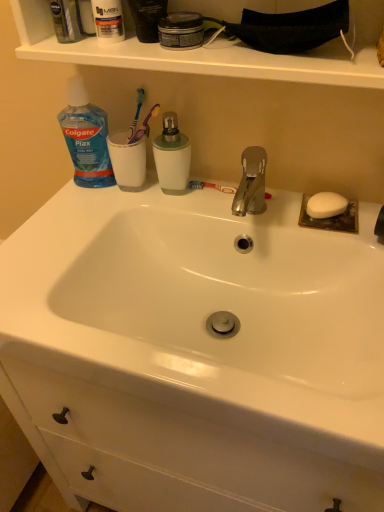
Question: From the image's perspective, is blue plastic toothbrush at upper center on green matte mouthwash at center, marked as the 1th mouthwash in a right-to-left arrangement?

Choices:
 (A) no
 (B) yes

Answer: (B)

Question: Does blue plastic toothbrush at upper center have a lesser width compared to green matte mouthwash at center, the first mouthwash in the bottom-to-top sequence?

Choices:
 (A) yes
 (B) no

Answer: (A)

Question: Is blue plastic toothbrush at upper center looking in the opposite direction of green matte mouthwash at center, positioned as the 2th mouthwash in top-to-bottom order?

Choices:
 (A) yes
 (B) no

Answer: (B)

Question: Does blue plastic toothbrush at upper center have a greater width compared to green matte mouthwash at center, marked as the 1th mouthwash in a right-to-left arrangement?

Choices:
 (A) yes
 (B) no

Answer: (B)

Question: Would you say blue plastic toothbrush at upper center contains green matte mouthwash at center, marked as the 1th mouthwash in a right-to-left arrangement?

Choices:
 (A) yes
 (B) no

Answer: (B)

Question: Does blue plastic toothbrush at upper center come behind green matte mouthwash at center, the first mouthwash in the bottom-to-top sequence?

Choices:
 (A) no
 (B) yes

Answer: (B)

Question: Can you confirm if white matte soap at right is taller than white glossy sink at center?

Choices:
 (A) yes
 (B) no

Answer: (B)

Question: Can you confirm if white matte soap at right is thinner than white glossy sink at center?

Choices:
 (A) no
 (B) yes

Answer: (B)

Question: Can you confirm if white matte soap at right is wider than white glossy sink at center?

Choices:
 (A) no
 (B) yes

Answer: (A)

Question: Considering the relative sizes of white matte soap at right and white glossy sink at center in the image provided, is white matte soap at right bigger than white glossy sink at center?

Choices:
 (A) no
 (B) yes

Answer: (A)

Question: Does white matte soap at right have a smaller size compared to white glossy sink at center?

Choices:
 (A) no
 (B) yes

Answer: (B)

Question: Is white matte soap at right surrounding white glossy sink at center?

Choices:
 (A) no
 (B) yes

Answer: (A)

Question: Is white matte soap at right oriented away from blue translucent plastic bottle at upper left?

Choices:
 (A) yes
 (B) no

Answer: (B)